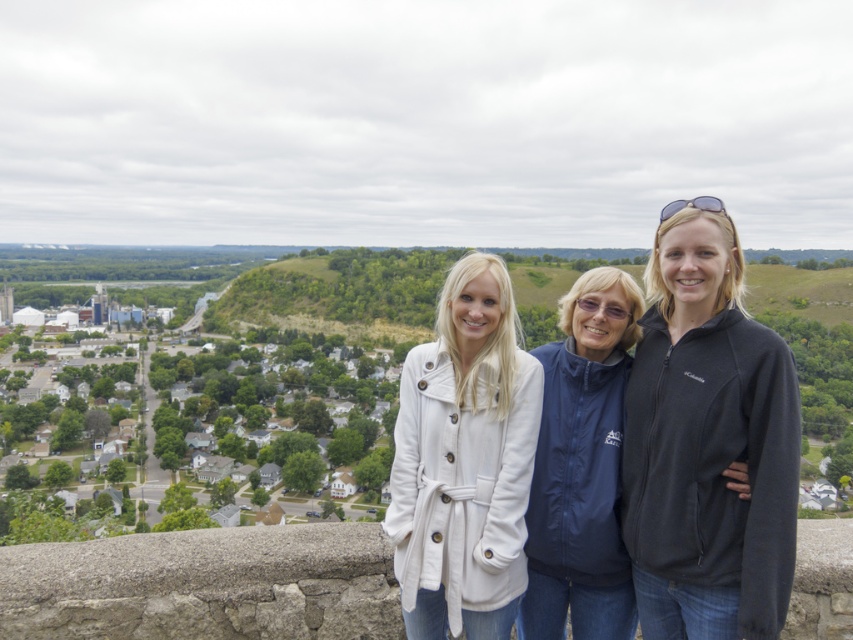
You are a photographer trying to capture a group photo of the three people in the scene. You notice two white fleece items at the center. Which one is more to the left between the white fleece jacket at center and the white fleece coat at center?

The white fleece coat at center is more to the left because the white fleece jacket at center is positioned on the right side of it.

Based on the scene description, where exactly is the white fleece jacket at center located in terms of coordinates?

The white fleece jacket at center is located at coordinates point [706,444].